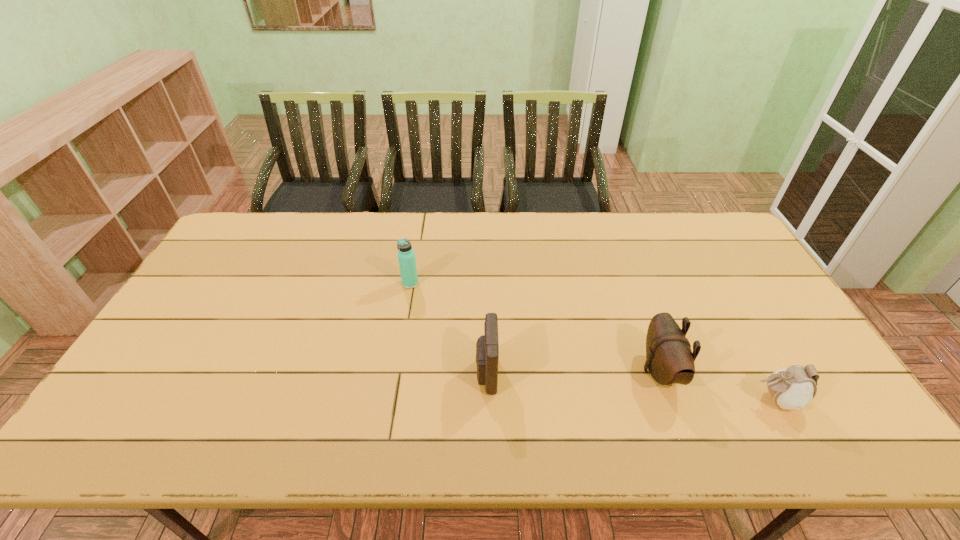
Image resolution: width=960 pixels, height=540 pixels. What are the coordinates of `vacant space located 0.170m with the flap open on the second pouch from right to left` in the screenshot? It's located at (577, 370).

The height and width of the screenshot is (540, 960). Identify the location of free space located 0.090m with the flap open on the second pouch from right to left. (608, 370).

Identify the location of free space located with the flap open on the second pouch from right to left. The image size is (960, 540). (600, 370).

What are the coordinates of `blank area located on the front-facing side of the shortest object` in the screenshot? It's located at (691, 400).

Image resolution: width=960 pixels, height=540 pixels. What are the coordinates of `vacant space located on the front-facing side of the shortest object` in the screenshot? It's located at (606, 400).

Find the location of a particular element. This screenshot has height=540, width=960. free point located on the front-facing side of the shortest object is located at coordinates (675, 400).

The image size is (960, 540). I want to click on object present at the near edge, so tap(793, 388).

Locate an element on the screen. The height and width of the screenshot is (540, 960). object that is at the right edge is located at coordinates (793, 388).

Find the location of `object that is positioned at the near right corner`. object that is positioned at the near right corner is located at coordinates (793, 388).

What are the coordinates of `blank space at the far edge of the desktop` in the screenshot? It's located at (324, 229).